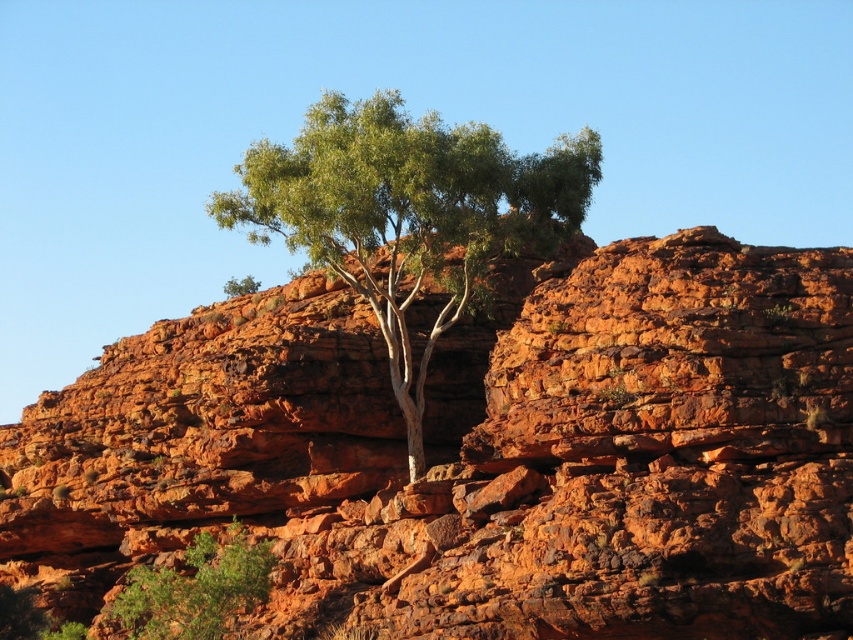
You are a hiker standing at the base of the red rock formation. You see the green leafy tree at center and the green leafy tree at lower left. Which tree is closer to you?

The green leafy tree at center is closer to you because the green leafy tree at lower left is behind it.

You are a hiker who wants to take a photo of the green leafy tree at center without the rusty rock at center appearing in the frame. Is it possible to do so by adjusting your position?

The rusty rock at center is located below the green leafy tree at center, so if you position yourself higher than the rock and aim your camera upwards towards the tree, you can exclude the rock from the frame.